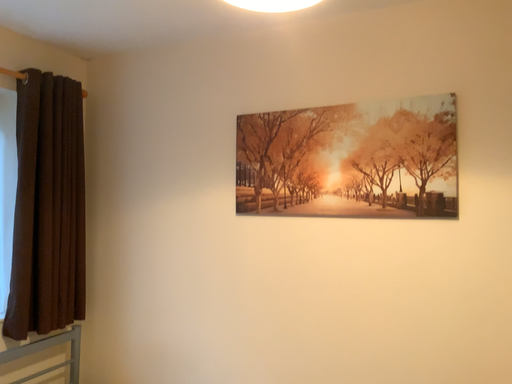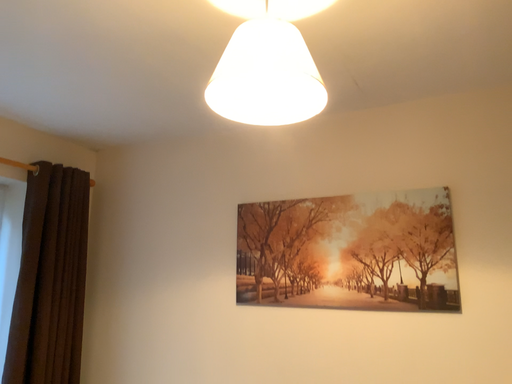
Question: How did the camera likely rotate when shooting the video?

Choices:
 (A) rotated downward
 (B) rotated upward

Answer: (B)